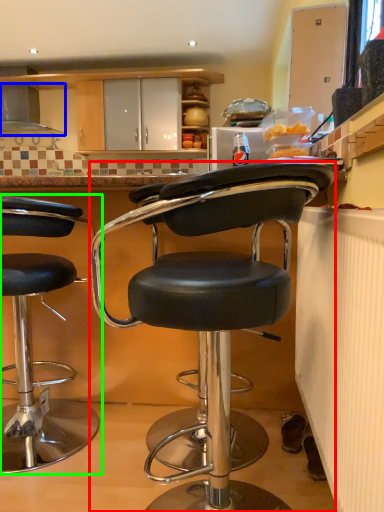
Question: Considering the real-world distances, which object is closest to chair (highlighted by a red box)? exhaust hood (highlighted by a blue box) or chair (highlighted by a green box).

Choices:
 (A) exhaust hood
 (B) chair

Answer: (B)